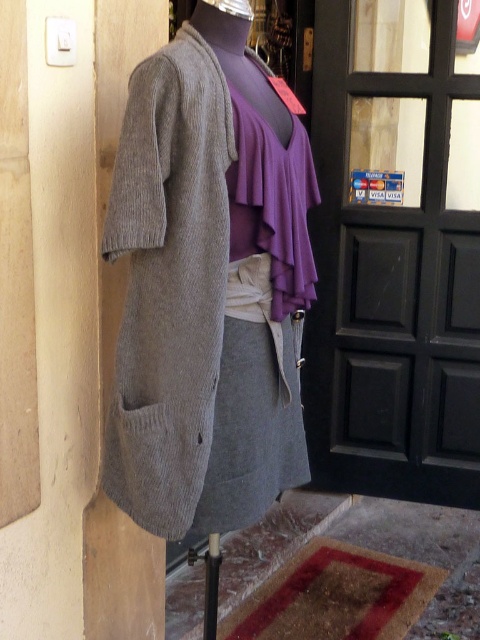
Question: Which point is closer to the camera?

Choices:
 (A) black glass door at upper right
 (B) knitted gray jacket at center

Answer: (B)

Question: In this image, where is knitted gray jacket at center located relative to black glass door at upper right?

Choices:
 (A) below
 (B) above

Answer: (A)

Question: Does knitted gray jacket at center appear on the right side of black glass door at upper right?

Choices:
 (A) yes
 (B) no

Answer: (B)

Question: Does knitted gray jacket at center appear on the left side of black glass door at upper right?

Choices:
 (A) yes
 (B) no

Answer: (A)

Question: Which point is closer to the camera?

Choices:
 (A) click(342, 344)
 (B) click(117, 412)

Answer: (B)